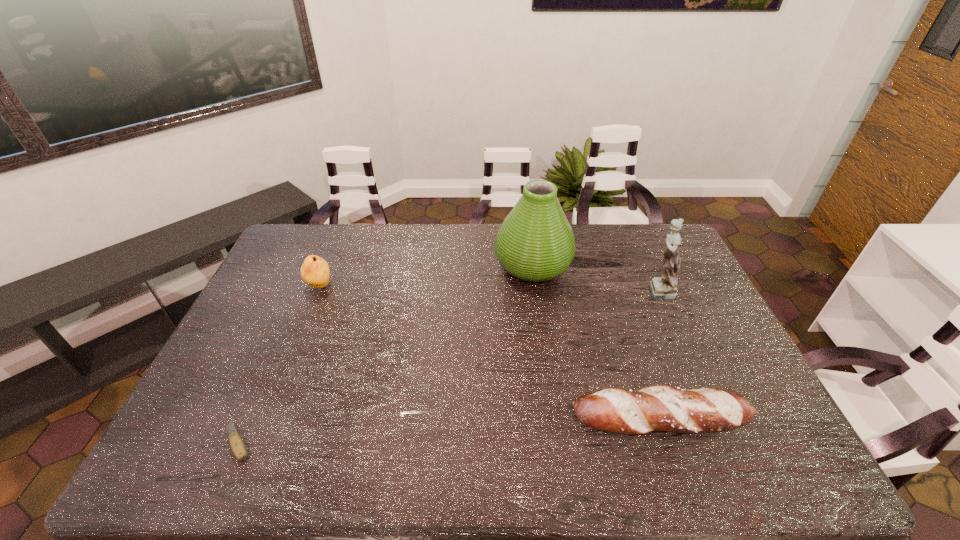
Find the location of a particular element. Image resolution: width=960 pixels, height=540 pixels. free region located 0.080m on the left of the baguet is located at coordinates (540, 420).

The image size is (960, 540). What are the coordinates of `free space located on the left of the pocketknife` in the screenshot? It's located at (193, 442).

You are a GUI agent. You are given a task and a screenshot of the screen. Output one action in this format:
    pyautogui.click(x=<x>, y=<y>)
    Task: Click on the object at the far edge
    This screenshot has height=540, width=960.
    Given the screenshot: What is the action you would take?
    pyautogui.click(x=535, y=242)

Where is `baguet located in the near edge section of the desktop`? The image size is (960, 540). baguet located in the near edge section of the desktop is located at coordinates (665, 408).

The image size is (960, 540). In order to click on pocketknife that is at the near edge in this screenshot , I will do `click(237, 445)`.

I want to click on pear located in the left edge section of the desktop, so click(x=315, y=271).

Find the location of a particular element. pocketknife that is at the left edge is located at coordinates (237, 445).

Identify the location of figurine located in the right edge section of the desktop. Image resolution: width=960 pixels, height=540 pixels. (665, 288).

The image size is (960, 540). Identify the location of baguet situated at the right edge. (665, 408).

Image resolution: width=960 pixels, height=540 pixels. Find the location of `object situated at the near left corner`. object situated at the near left corner is located at coordinates click(237, 445).